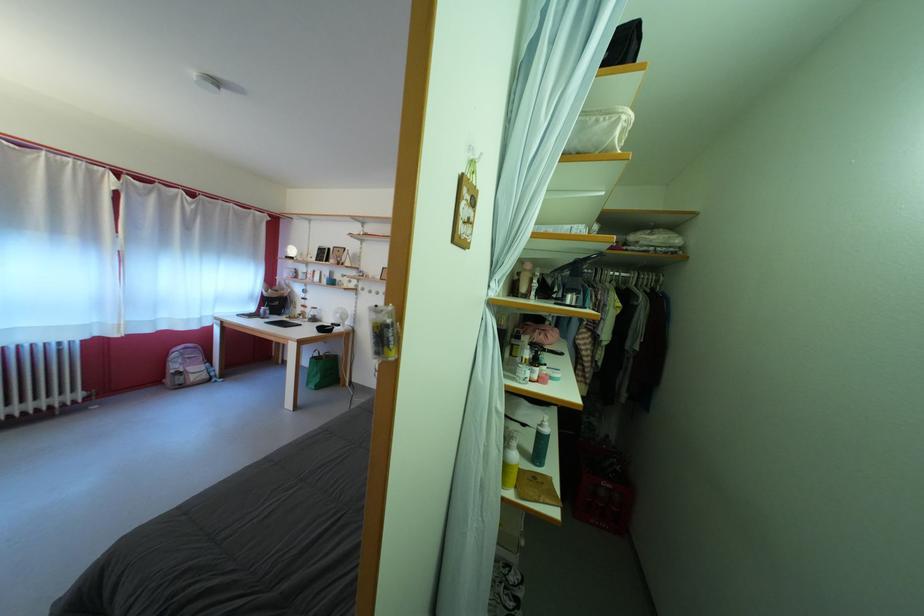
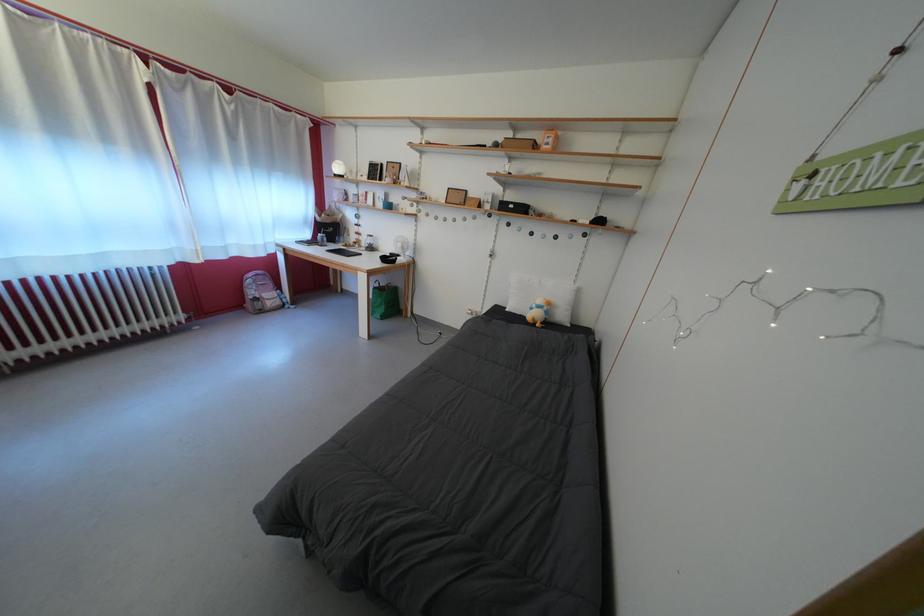
Locate, in the second image, the point that corresponds to point (335, 328) in the first image.

(394, 257)